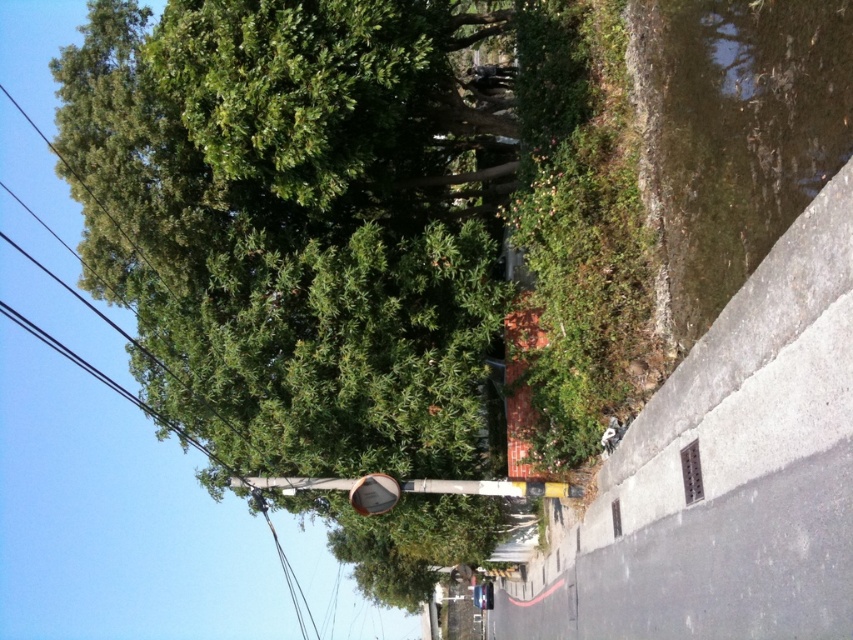
Between green leafy tree at upper left and metallic pole at center, which one appears on the left side from the viewer's perspective?

green leafy tree at upper left

Describe the element at coordinates (299, 221) in the screenshot. I see `green leafy tree at upper left` at that location.

What are the coordinates of `green leafy tree at upper left` in the screenshot? It's located at (299, 221).

Find the location of `green leafy tree at upper left`. green leafy tree at upper left is located at coordinates (299, 221).